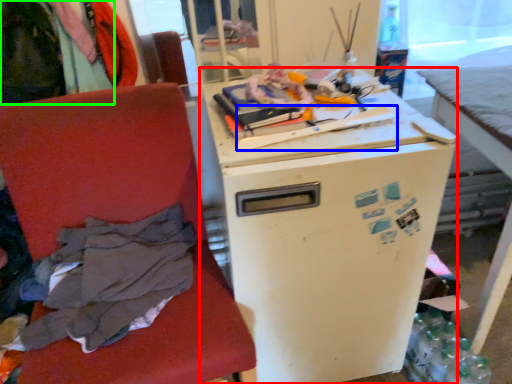
Question: Estimate the real-world distances between objects in this image. Which object is closer to refrigerator (highlighted by a red box), equipment (highlighted by a blue box) or clothing (highlighted by a green box)?

Choices:
 (A) equipment
 (B) clothing

Answer: (A)